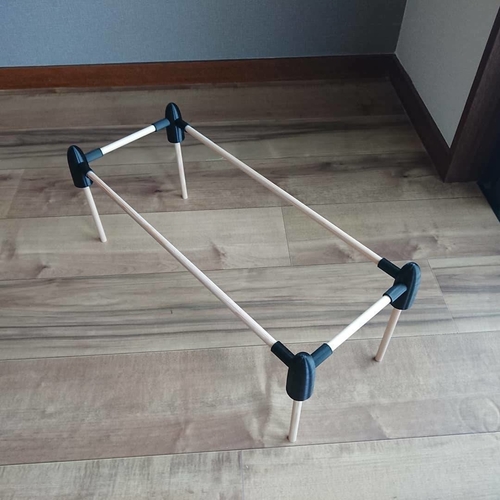
What are the coordinates of `wood floor` in the screenshot? It's located at (198, 392).